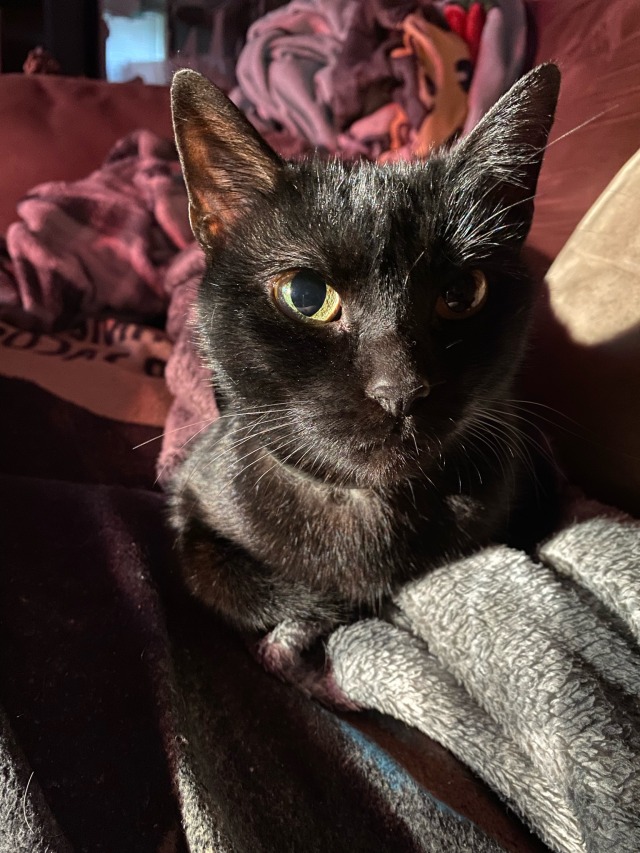
This screenshot has height=853, width=640. I want to click on blanket, so click(486, 743).